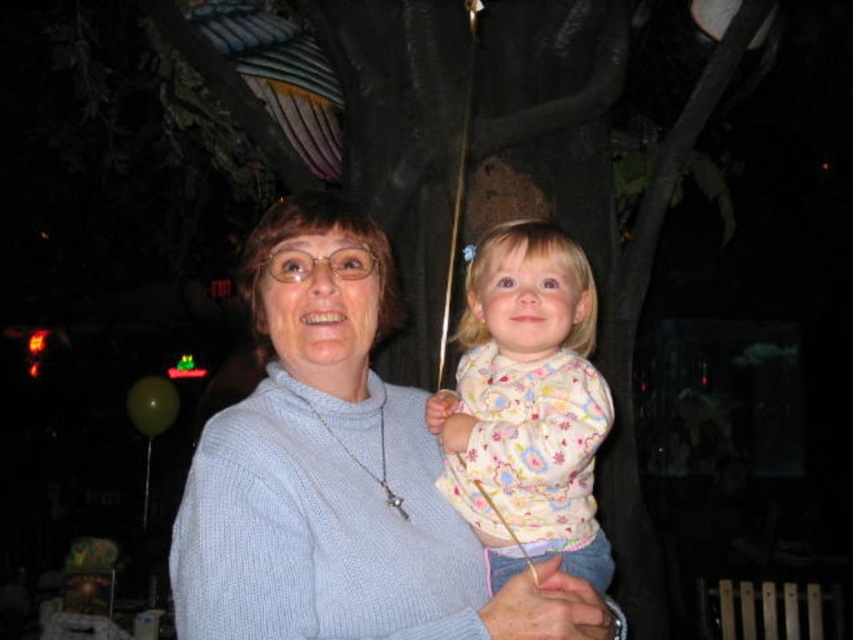
Does point (434, 589) lie in front of point (567, 408)?

Yes, it is in front of point (567, 408).

Is light blue sweater at center to the right of fluffy cotton sweater at center from the viewer's perspective?

No, light blue sweater at center is not to the right of fluffy cotton sweater at center.

The height and width of the screenshot is (640, 853). In order to click on light blue sweater at center in this screenshot , I will do `click(338, 474)`.

I want to click on light blue sweater at center, so click(x=338, y=474).